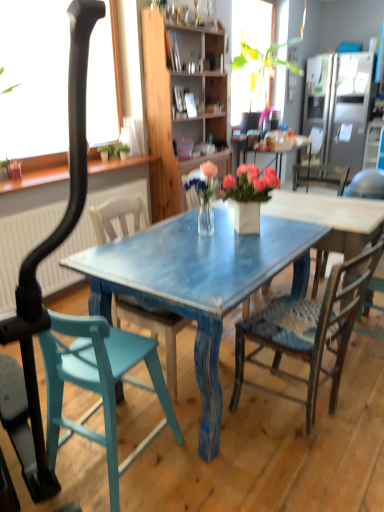
Question: Is satin silver refrigerator at upper right further to the viewer compared to teal wood chair at center, the 2th chair viewed from the left?

Choices:
 (A) no
 (B) yes

Answer: (B)

Question: Considering the relative sizes of satin silver refrigerator at upper right and teal wood chair at center, which appears as the 3th chair when viewed from the right, in the image provided, is satin silver refrigerator at upper right taller than teal wood chair at center, which appears as the 3th chair when viewed from the right,?

Choices:
 (A) yes
 (B) no

Answer: (A)

Question: Is satin silver refrigerator at upper right shorter than teal wood chair at center, which appears as the 3th chair when viewed from the right?

Choices:
 (A) no
 (B) yes

Answer: (A)

Question: Is teal wood chair at center, which appears as the 3th chair when viewed from the right, completely or partially inside satin silver refrigerator at upper right?

Choices:
 (A) yes
 (B) no

Answer: (B)

Question: Is satin silver refrigerator at upper right wider than teal wood chair at center, which appears as the 3th chair when viewed from the right?

Choices:
 (A) yes
 (B) no

Answer: (A)

Question: Visually, is teal wood chair at center, which appears as the 3th chair when viewed from the right, positioned to the left or to the right of teal painted wood chair at lower left, positioned as the 4th chair in right-to-left order?

Choices:
 (A) left
 (B) right

Answer: (B)

Question: Is teal wood chair at center, the 2th chair viewed from the left, inside or outside of teal painted wood chair at lower left, positioned as the 4th chair in right-to-left order?

Choices:
 (A) inside
 (B) outside

Answer: (B)

Question: From a real-world perspective, relative to teal painted wood chair at lower left, positioned as the 4th chair in right-to-left order, is teal wood chair at center, the 2th chair viewed from the left, vertically above or below?

Choices:
 (A) above
 (B) below

Answer: (A)

Question: Considering the positions of teal wood chair at center, the 2th chair viewed from the left, and teal painted wood chair at lower left, positioned as the 4th chair in right-to-left order, in the image, is teal wood chair at center, the 2th chair viewed from the left, wider or thinner than teal painted wood chair at lower left, positioned as the 4th chair in right-to-left order,?

Choices:
 (A) wide
 (B) thin

Answer: (A)

Question: Do you think wooden cabinet at center is within wooden chair with woven seat at center, arranged as the 2th chair when viewed from the right, or outside of it?

Choices:
 (A) inside
 (B) outside

Answer: (B)

Question: In terms of width, does wooden cabinet at center look wider or thinner when compared to wooden chair with woven seat at center, arranged as the 2th chair when viewed from the right?

Choices:
 (A) wide
 (B) thin

Answer: (B)

Question: Is point (223, 96) positioned closer to the camera than point (286, 318)?

Choices:
 (A) farther
 (B) closer

Answer: (A)

Question: Relative to wooden chair with woven seat at center, which appears as the third chair when viewed from the left, is wooden cabinet at center in front or behind?

Choices:
 (A) front
 (B) behind

Answer: (B)

Question: Considering the positions of point (354, 121) and point (87, 352), is point (354, 121) closer or farther from the camera than point (87, 352)?

Choices:
 (A) closer
 (B) farther

Answer: (B)

Question: From a real-world perspective, relative to teal painted wood chair at lower left, positioned as the 4th chair in right-to-left order, is satin silver refrigerator at upper right vertically above or below?

Choices:
 (A) below
 (B) above

Answer: (B)